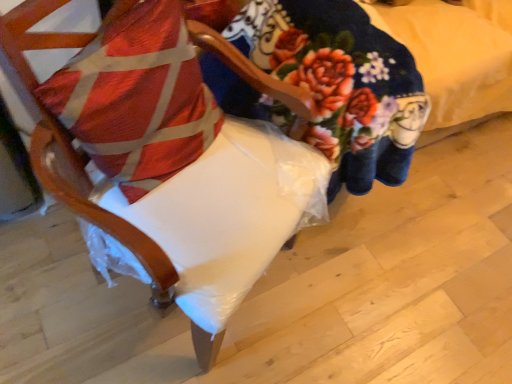
This screenshot has width=512, height=384. What do you see at coordinates (137, 98) in the screenshot?
I see `textured red pillow at left` at bounding box center [137, 98].

I want to click on textured red pillow at left, so click(137, 98).

The height and width of the screenshot is (384, 512). I want to click on white fabric chair at center, so click(x=174, y=156).

The image size is (512, 384). What do you see at coordinates (174, 156) in the screenshot?
I see `white fabric chair at center` at bounding box center [174, 156].

Where is `textured red pillow at left`? textured red pillow at left is located at coordinates (137, 98).

Considering the positions of objects textured red pillow at left and white fabric chair at center in the image provided, who is more to the left, textured red pillow at left or white fabric chair at center?

textured red pillow at left is more to the left.

Is textured red pillow at left in front of or behind white fabric chair at center in the image?

Clearly, textured red pillow at left is behind white fabric chair at center.

Does point (181, 141) appear closer or farther from the camera than point (174, 241)?

Point (181, 141) is farther from the camera than point (174, 241).

From the image's perspective, is textured red pillow at left under white fabric chair at center?

No, from the image's perspective, textured red pillow at left is not below white fabric chair at center.

From a real-world perspective, which is physically below, textured red pillow at left or white fabric chair at center?

white fabric chair at center.

Looking at this image, is textured red pillow at left thinner than white fabric chair at center?

Yes, textured red pillow at left is thinner than white fabric chair at center.

Who is shorter, textured red pillow at left or white fabric chair at center?

textured red pillow at left is shorter.

Between textured red pillow at left and white fabric chair at center, which one has smaller size?

textured red pillow at left is smaller.

Would you say textured red pillow at left is inside or outside white fabric chair at center?

textured red pillow at left fits inside white fabric chair at center.

Can you see textured red pillow at left touching white fabric chair at center?

Absolutely, textured red pillow at left is next to and touching white fabric chair at center.

Could you tell me if textured red pillow at left is facing white fabric chair at center?

Yes, textured red pillow at left is oriented towards white fabric chair at center.

How different are the orientations of textured red pillow at left and white fabric chair at center in degrees?

The angle between the facing direction of textured red pillow at left and the facing direction of white fabric chair at center is 5.95 degrees.

Measure the distance from textured red pillow at left to white fabric chair at center.

textured red pillow at left is 6.01 centimeters from white fabric chair at center.

This screenshot has width=512, height=384. There is a white fabric chair at center. Find the location of `pillow above it (from a real-world perspective)`. pillow above it (from a real-world perspective) is located at coordinates (137, 98).

Is white fabric chair at center at the left side of textured red pillow at left?

No.

Which is behind, white fabric chair at center or textured red pillow at left?

textured red pillow at left is behind.

Which is nearer, (160, 103) or (188, 95)?

Point (160, 103)

From the image's perspective, is white fabric chair at center located above or below textured red pillow at left?

Clearly, from the image's perspective, white fabric chair at center is below textured red pillow at left.

From a real-world perspective, between white fabric chair at center and textured red pillow at left, who is vertically lower?

white fabric chair at center.

Can you confirm if white fabric chair at center is thinner than textured red pillow at left?

Incorrect, the width of white fabric chair at center is not less than that of textured red pillow at left.

Which of these two, white fabric chair at center or textured red pillow at left, stands taller?

white fabric chair at center.

Between white fabric chair at center and textured red pillow at left, which one has larger size?

With larger size is white fabric chair at center.

Is textured red pillow at left inside white fabric chair at center?

Yes, textured red pillow at left is inside white fabric chair at center.

From the picture: Is white fabric chair at center in contact with textured red pillow at left?

Absolutely, white fabric chair at center is next to and touching textured red pillow at left.

Is white fabric chair at center positioned with its back to textured red pillow at left?

Yes, white fabric chair at center is positioned with its back facing textured red pillow at left.

How far apart are white fabric chair at center and textured red pillow at left?

2.37 inches.

You are a GUI agent. You are given a task and a screenshot of the screen. Output one action in this format:
    pyautogui.click(x=<x>, y=<y>)
    Task: Click on the chair below the textured red pillow at left (from a real-world perspective)
    The width and height of the screenshot is (512, 384).
    Given the screenshot: What is the action you would take?
    pyautogui.click(x=174, y=156)

Image resolution: width=512 pixels, height=384 pixels. Find the location of `chair on the right side of textured red pillow at left`. chair on the right side of textured red pillow at left is located at coordinates (174, 156).

This screenshot has width=512, height=384. Find the location of `pillow above the white fabric chair at center (from a real-world perspective)`. pillow above the white fabric chair at center (from a real-world perspective) is located at coordinates click(137, 98).